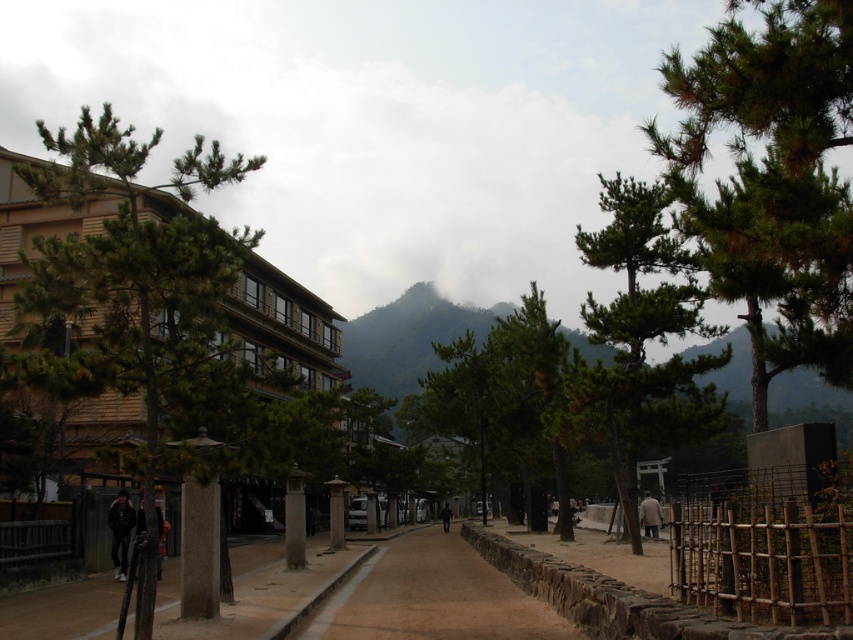
Is point (820, 323) farther from camera compared to point (216, 253)?

Yes, point (820, 323) is behind point (216, 253).

Is green needle-like leaves at upper right positioned in front of green textured tree at left?

Yes, green needle-like leaves at upper right is closer to the viewer.

Who is more distant from viewer, (795, 308) or (42, 278)?

Positioned behind is point (795, 308).

Locate an element on the screen. The image size is (853, 640). green needle-like leaves at upper right is located at coordinates (773, 179).

Looking at this image, who is more distant from viewer, (102, 145) or (518, 632)?

The point (518, 632) is behind.

Is green textured tree at left closer to camera compared to brown stone path at center?

That is True.

Which is in front, point (61, 275) or point (376, 579)?

Point (61, 275) is in front.

This screenshot has height=640, width=853. In order to click on green textured tree at left in this screenshot , I will do [x=136, y=262].

Does green textured tree at right have a smaller size compared to brown stone path at center?

No, green textured tree at right is not smaller than brown stone path at center.

Which is in front, point (582, 250) or point (440, 621)?

Point (440, 621) is in front.

At what (x,y) coordinates should I click in order to perform the action: click on green textured tree at right. Please return your answer as a coordinate pair (x, y). The width and height of the screenshot is (853, 640). Looking at the image, I should click on (645, 333).

Locate an element on the screen. green textured tree at right is located at coordinates (645, 333).